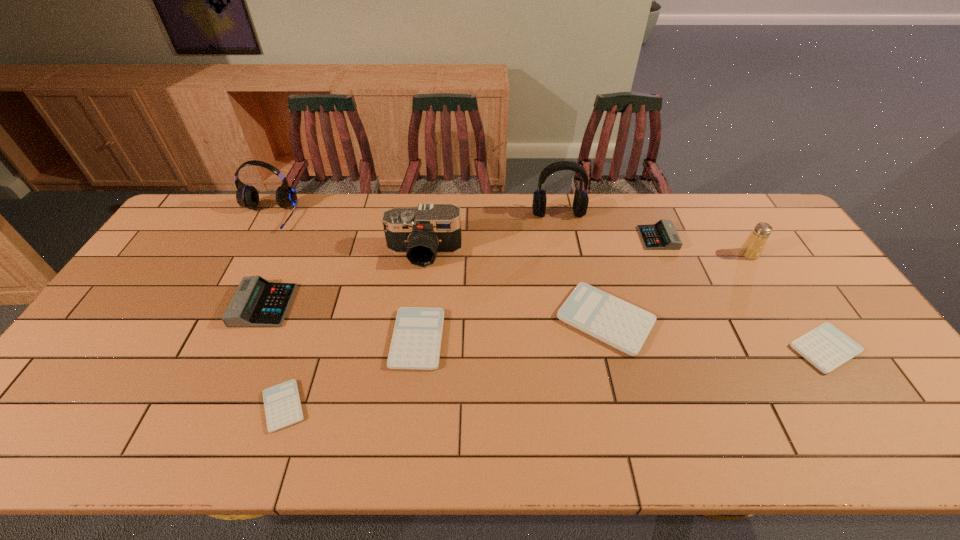
Where is `the right headset`? The height and width of the screenshot is (540, 960). the right headset is located at coordinates (580, 203).

Image resolution: width=960 pixels, height=540 pixels. Identify the location of the left headset. (247, 196).

Identify the location of black camera. The width and height of the screenshot is (960, 540). (421, 233).

At what (x,y) coordinates should I click in order to perform the action: click on the third tallest object. Please return your answer as a coordinate pair (x, y). Looking at the image, I should click on (421, 233).

Where is `the seventh shortest object`? the seventh shortest object is located at coordinates (752, 248).

Where is `the tallest calculator`? the tallest calculator is located at coordinates (257, 302).

Where is `the left gray calculator`? This screenshot has height=540, width=960. the left gray calculator is located at coordinates (257, 302).

This screenshot has height=540, width=960. In order to click on the fifth calculator from left to right in this screenshot , I will do click(x=662, y=235).

Identify the location of the fifth shortest object. (662, 235).

Locate an element on the screen. the fourth shortest calculator is located at coordinates (624, 326).